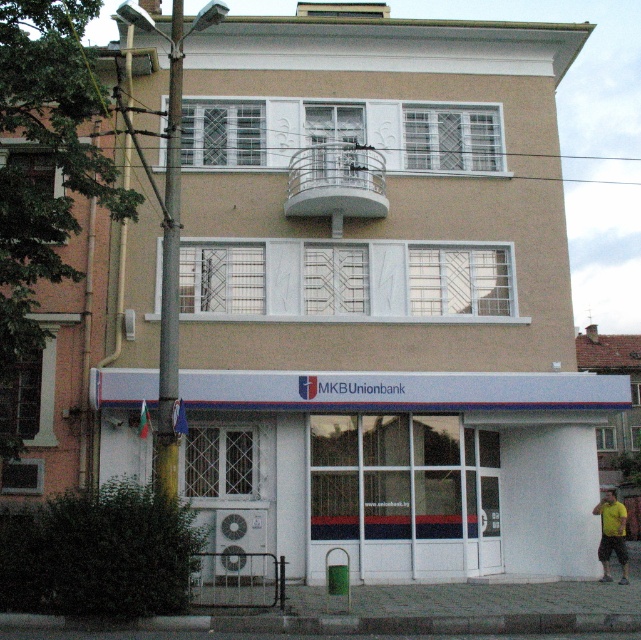
You are a window cleaner with a ladder that can reach up to 3 meters. You need to clean the white glossy storefront at center and the green painted metal pole at left. Which object will require you to use the ladder?

The green painted metal pole at left requires the ladder because it is taller than the white glossy storefront at center, and the ladder can reach up to 3 meters.